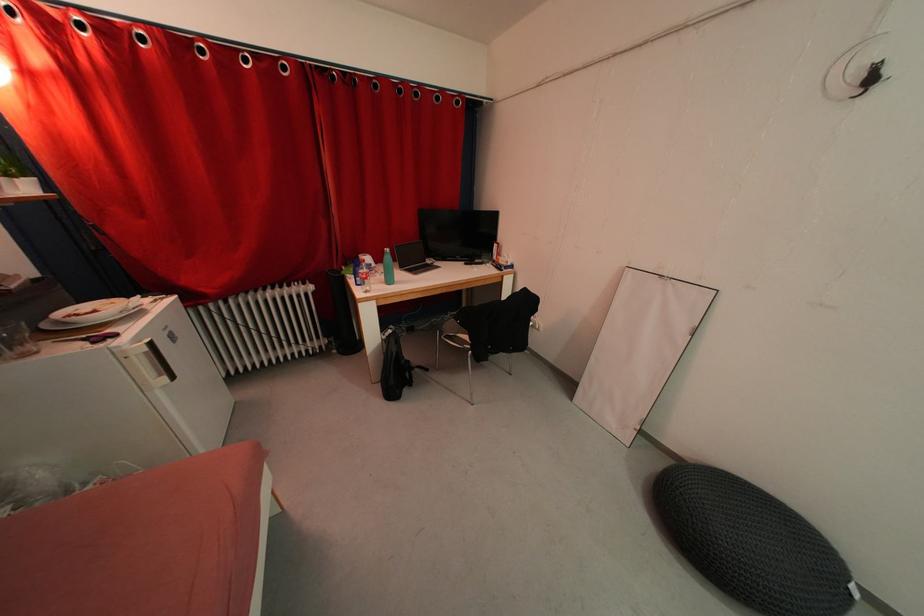
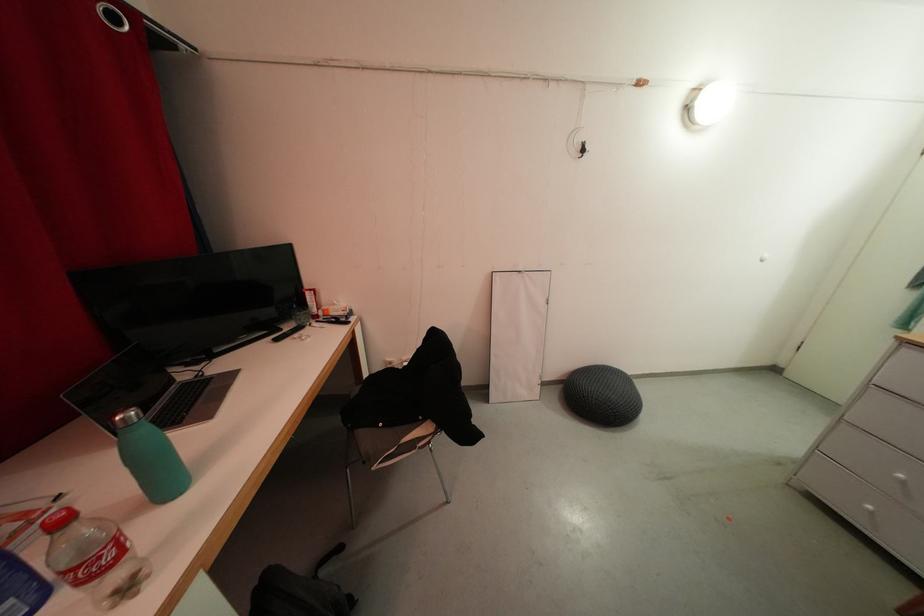
In the second image, find the point that corresponds to (418,386) in the first image.

(357, 601)